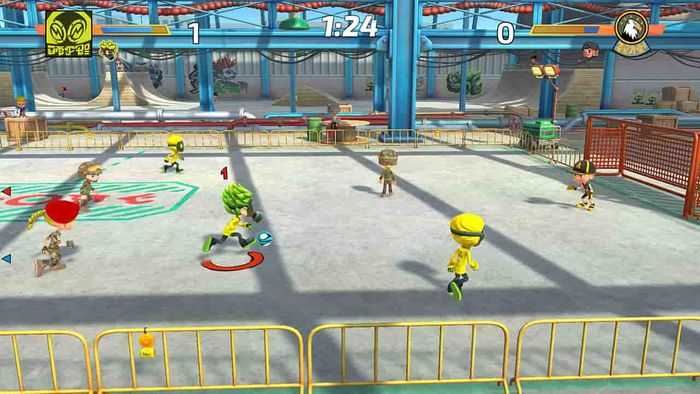
Locate an element on the screen. indoor  flooring is located at coordinates (357, 214), (500, 205), (176, 249), (17, 154).